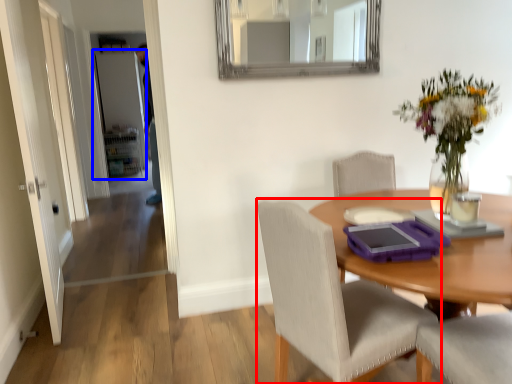
Question: Which object appears closest to the camera in this image, chair (highlighted by a red box) or door (highlighted by a blue box)?

Choices:
 (A) chair
 (B) door

Answer: (A)